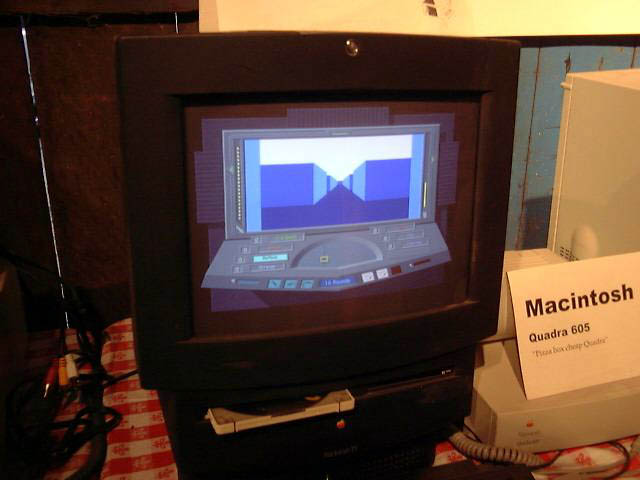
Where is `board`? This screenshot has height=480, width=640. board is located at coordinates pyautogui.click(x=522, y=124), pyautogui.click(x=548, y=147), pyautogui.click(x=639, y=60).